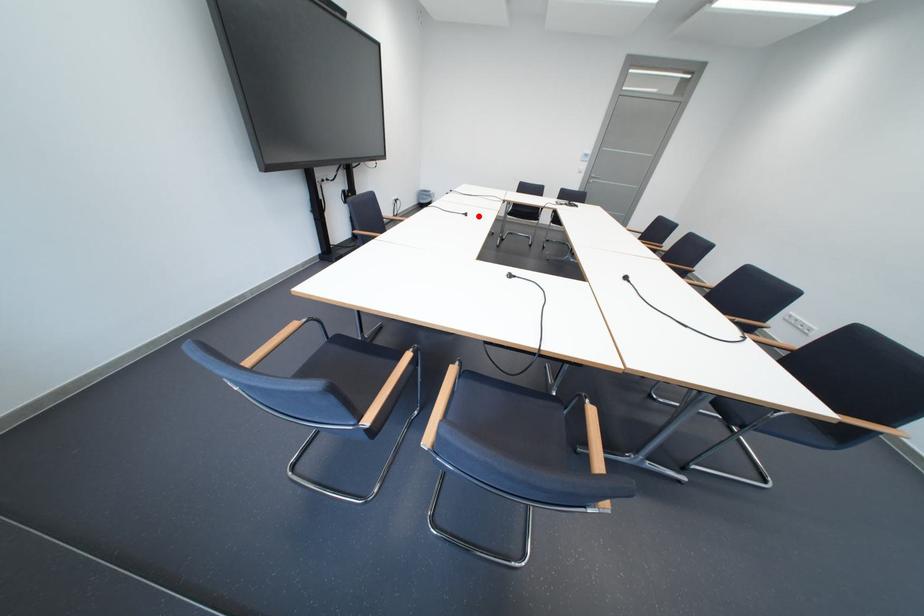
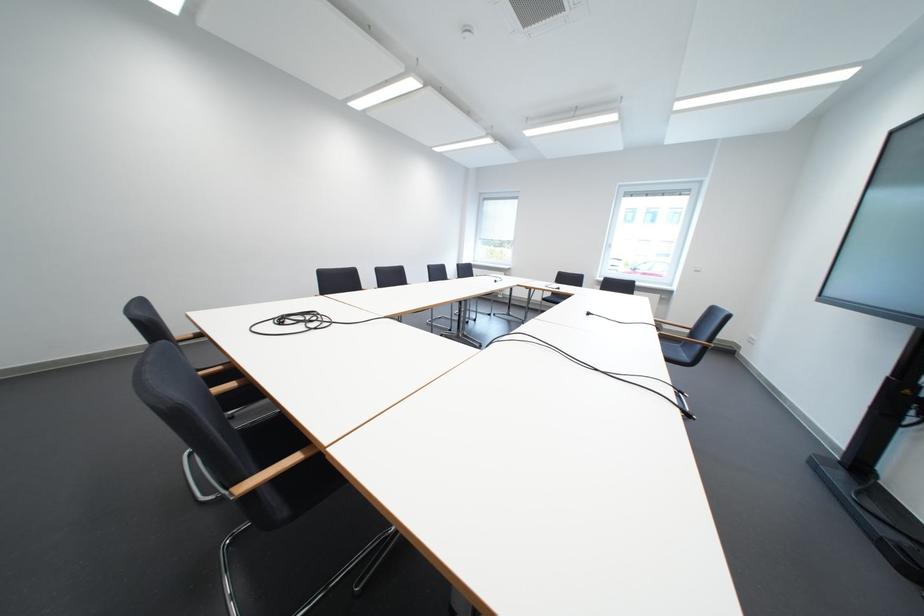
Question: I am providing you with two images of the same scene from different viewpoints. In image1, a red point is highlighted. Considering the same 3D point in image2, which of the following is correct?

Choices:
 (A) It is closer
 (B) It is farther

Answer: (B)